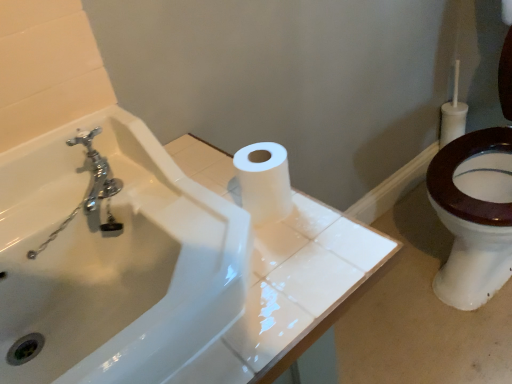
Identify the location of white glossy sink at upper center. (114, 260).

The height and width of the screenshot is (384, 512). Describe the element at coordinates (114, 260) in the screenshot. I see `white glossy sink at upper center` at that location.

You are a GUI agent. You are given a task and a screenshot of the screen. Output one action in this format:
    pyautogui.click(x=<x>, y=<y>)
    Task: Click on the white matte toilet paper at center
    The image size is (512, 384).
    Given the screenshot: What is the action you would take?
    pyautogui.click(x=264, y=181)

The width and height of the screenshot is (512, 384). Describe the element at coordinates (264, 181) in the screenshot. I see `white matte toilet paper at center` at that location.

The width and height of the screenshot is (512, 384). I want to click on white glossy sink at upper center, so click(114, 260).

Can you confirm if white glossy sink at upper center is positioned to the left of white matte toilet paper at center?

Indeed, white glossy sink at upper center is positioned on the left side of white matte toilet paper at center.

Is white glossy sink at upper center in front of or behind white matte toilet paper at center in the image?

white glossy sink at upper center is positioned closer to the viewer than white matte toilet paper at center.

Which is closer, (157, 287) or (286, 185)?

Point (157, 287) is positioned farther from the camera compared to point (286, 185).

From the image's perspective, which one is positioned lower, white glossy sink at upper center or white matte toilet paper at center?

white glossy sink at upper center is shown below in the image.

From a real-world perspective, between white glossy sink at upper center and white matte toilet paper at center, who is vertically lower?

white glossy sink at upper center is physically lower.

In the scene shown: Considering the relative sizes of white glossy sink at upper center and white matte toilet paper at center in the image provided, is white glossy sink at upper center thinner than white matte toilet paper at center?

No.

Is white glossy sink at upper center shorter than white matte toilet paper at center?

No.

Based on their sizes in the image, would you say white glossy sink at upper center is bigger or smaller than white matte toilet paper at center?

Clearly, white glossy sink at upper center is larger in size than white matte toilet paper at center.

Is white glossy sink at upper center surrounding white matte toilet paper at center?

That's incorrect, white matte toilet paper at center is not inside white glossy sink at upper center.

Is white glossy sink at upper center next to white matte toilet paper at center and touching it?

No, white glossy sink at upper center is not touching white matte toilet paper at center.

Is white glossy sink at upper center positioned with its back to white matte toilet paper at center?

No, white glossy sink at upper center is not facing away from white matte toilet paper at center.

How different are the orientations of white glossy sink at upper center and white matte toilet paper at center in degrees?

The facing directions of white glossy sink at upper center and white matte toilet paper at center are 1.24 degrees apart.

Image resolution: width=512 pixels, height=384 pixels. Identify the location of toilet paper above the white glossy sink at upper center (from the image's perspective). (264, 181).

Looking at this image, which is more to the left, white matte toilet paper at center or white glossy sink at upper center?

white glossy sink at upper center.

Is white matte toilet paper at center further to camera compared to white glossy sink at upper center?

Yes, white matte toilet paper at center is further from the viewer.

Does point (244, 203) come in front of point (127, 140)?

Yes.

From the image's perspective, who appears lower, white matte toilet paper at center or white glossy sink at upper center?

white glossy sink at upper center is shown below in the image.

From a real-world perspective, is white matte toilet paper at center above or below white glossy sink at upper center?

From a real-world perspective, white matte toilet paper at center is physically above white glossy sink at upper center.

In terms of width, does white matte toilet paper at center look wider or thinner when compared to white glossy sink at upper center?

Clearly, white matte toilet paper at center has less width compared to white glossy sink at upper center.

Considering the sizes of objects white matte toilet paper at center and white glossy sink at upper center in the image provided, who is shorter, white matte toilet paper at center or white glossy sink at upper center?

white matte toilet paper at center is shorter.

Based on the photo, does white matte toilet paper at center have a smaller size compared to white glossy sink at upper center?

Correct, white matte toilet paper at center occupies less space than white glossy sink at upper center.

Would you say white matte toilet paper at center is outside white glossy sink at upper center?

Yes.

Is white matte toilet paper at center far from white glossy sink at upper center?

white matte toilet paper at center is actually quite close to white glossy sink at upper center.

Is white matte toilet paper at center turned away from white glossy sink at upper center?

No.

What are the coordinates of `sink that is in front of the white matte toilet paper at center` in the screenshot? It's located at (114, 260).

The height and width of the screenshot is (384, 512). I want to click on toilet paper behind the white glossy sink at upper center, so click(x=264, y=181).

Find the location of a particular element. The width and height of the screenshot is (512, 384). sink below the white matte toilet paper at center (from a real-world perspective) is located at coordinates (114, 260).